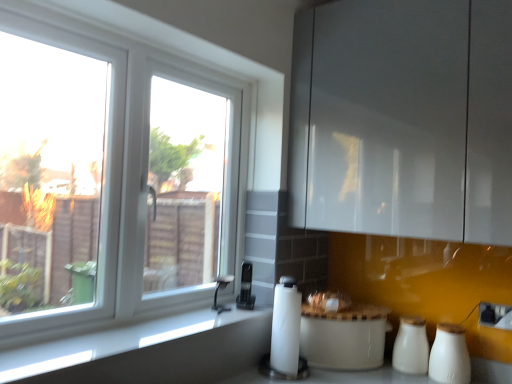
Question: Is white ceramic salt shaker at lower right, positioned as the 2th salt shaker in back-to-front order, taller than white plastic window at left?

Choices:
 (A) yes
 (B) no

Answer: (B)

Question: Considering the relative positions of white ceramic salt shaker at lower right, positioned as the 2th salt shaker in back-to-front order, and white plastic window at left in the image provided, is white ceramic salt shaker at lower right, positioned as the 2th salt shaker in back-to-front order, to the right of white plastic window at left from the viewer's perspective?

Choices:
 (A) yes
 (B) no

Answer: (A)

Question: From a real-world perspective, does white ceramic salt shaker at lower right, positioned as the 2th salt shaker in back-to-front order, sit lower than white plastic window at left?

Choices:
 (A) no
 (B) yes

Answer: (B)

Question: Is white ceramic salt shaker at lower right, positioned as the 2th salt shaker in back-to-front order, not within white plastic window at left?

Choices:
 (A) yes
 (B) no

Answer: (A)

Question: Is white plastic window at left surrounded by white ceramic salt shaker at lower right, positioned as the 2th salt shaker in back-to-front order?

Choices:
 (A) yes
 (B) no

Answer: (B)

Question: Considering the positions of point (164, 332) and point (295, 314), is point (164, 332) closer or farther from the camera than point (295, 314)?

Choices:
 (A) closer
 (B) farther

Answer: (A)

Question: Is smooth gray countertop at lower left spatially inside white matte paper towel at lower center, or outside of it?

Choices:
 (A) inside
 (B) outside

Answer: (B)

Question: Based on their sizes in the image, would you say smooth gray countertop at lower left is bigger or smaller than white matte paper towel at lower center?

Choices:
 (A) big
 (B) small

Answer: (B)

Question: Visually, is smooth gray countertop at lower left positioned to the left or to the right of white matte paper towel at lower center?

Choices:
 (A) left
 (B) right

Answer: (A)

Question: Considering their positions, is white glossy rice cooker at center, marked as the 1th appliance in a right-to-left arrangement, located in front of or behind white ceramic salt shaker at lower right, positioned as the 2th salt shaker in back-to-front order?

Choices:
 (A) behind
 (B) front

Answer: (A)

Question: From the image's perspective, is white glossy rice cooker at center, marked as the second appliance in a left-to-right arrangement, above or below white ceramic salt shaker at lower right, positioned as the 2th salt shaker in back-to-front order?

Choices:
 (A) above
 (B) below

Answer: (B)

Question: Would you say white glossy rice cooker at center, the 1th appliance positioned from the bottom, is inside or outside white ceramic salt shaker at lower right, arranged as the first salt shaker when viewed from the front?

Choices:
 (A) inside
 (B) outside

Answer: (B)

Question: Based on their sizes in the image, would you say white glossy rice cooker at center, arranged as the 2th appliance when viewed from the top, is bigger or smaller than white ceramic salt shaker at lower right, arranged as the first salt shaker when viewed from the front?

Choices:
 (A) small
 (B) big

Answer: (B)

Question: Is black plastic phone at center, the second appliance from the right, to the left or to the right of white plastic window at left in the image?

Choices:
 (A) left
 (B) right

Answer: (B)

Question: Considering the positions of point (251, 296) and point (138, 29), is point (251, 296) closer or farther from the camera than point (138, 29)?

Choices:
 (A) farther
 (B) closer

Answer: (A)